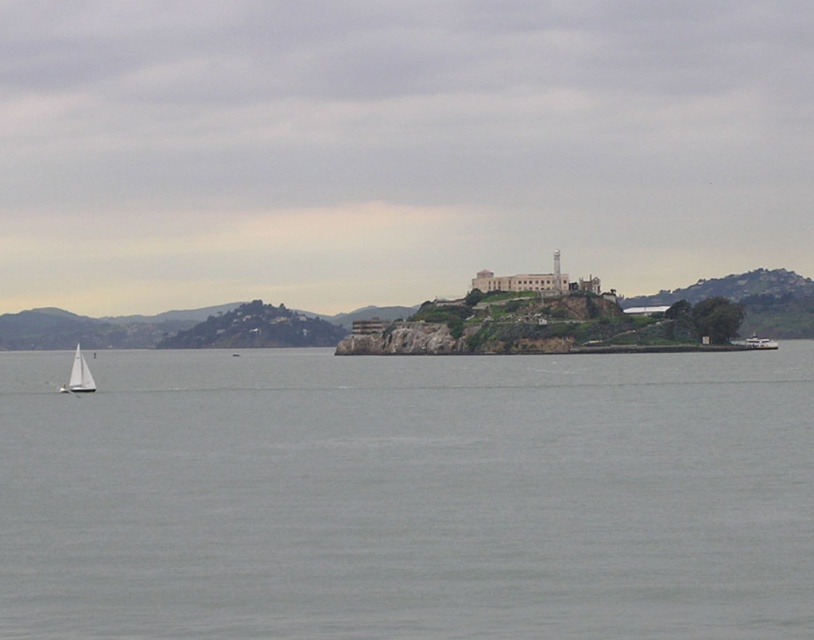
Does gray water at lower left have a lesser height compared to white matte sailboat at lower left?

Yes, gray water at lower left is shorter than white matte sailboat at lower left.

Which is above, gray water at lower left or white matte sailboat at lower left?

Positioned higher is gray water at lower left.

Who is more distant from viewer, (138, 563) or (90, 381)?

Point (90, 381)

Where is `gray water at lower left`? This screenshot has height=640, width=814. gray water at lower left is located at coordinates (407, 496).